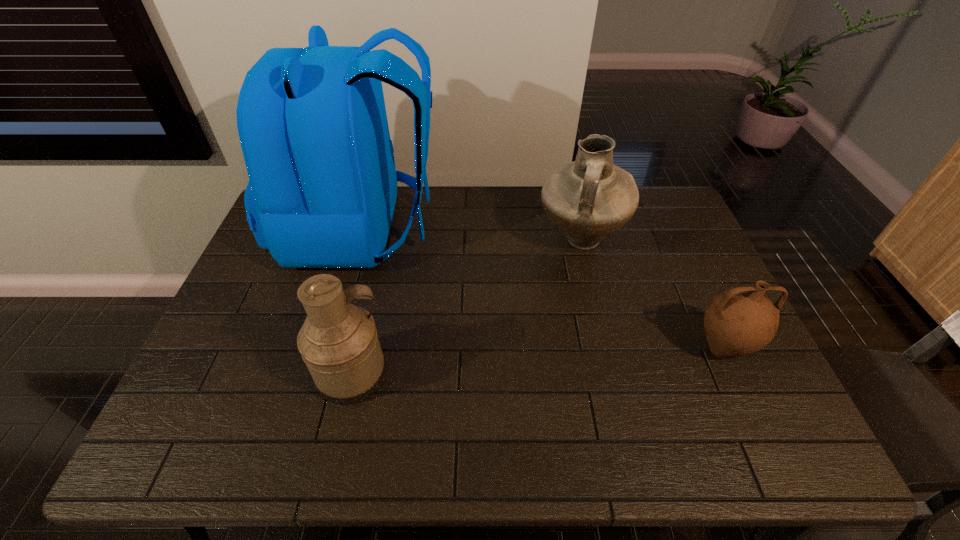
Locate an element on the screen. The height and width of the screenshot is (540, 960). backpack that is positioned at the far edge is located at coordinates (312, 123).

Identify the location of pitcher at the far edge. This screenshot has height=540, width=960. (588, 199).

You are a GUI agent. You are given a task and a screenshot of the screen. Output one action in this format:
    pyautogui.click(x=<x>, y=<y>)
    Task: Click on the object that is at the left edge
    
    Given the screenshot: What is the action you would take?
    pyautogui.click(x=312, y=123)

I want to click on object present at the right edge, so pos(739,321).

Identify the location of object located at the far left corner. This screenshot has width=960, height=540. (312, 123).

Where is `vacant space at the far edge of the desktop`? vacant space at the far edge of the desktop is located at coordinates (510, 188).

In the image, there is a desktop. Where is `vacant space at the right edge`? This screenshot has height=540, width=960. vacant space at the right edge is located at coordinates (707, 292).

You are a GUI agent. You are given a task and a screenshot of the screen. Output one action in this format:
    pyautogui.click(x=<x>, y=<y>)
    Task: Click on the vacant area at the near right corner of the desktop
    The width and height of the screenshot is (960, 540).
    Given the screenshot: What is the action you would take?
    pyautogui.click(x=784, y=443)

You are a GUI agent. You are given a task and a screenshot of the screen. Output one action in this format:
    pyautogui.click(x=<x>, y=<y>)
    Task: Click on the vacant space that's between the second pitcher from left to right and the leftmost pitcher
    The width and height of the screenshot is (960, 540).
    Given the screenshot: What is the action you would take?
    point(467,307)

The width and height of the screenshot is (960, 540). Identify the location of vacant region between the leftmost pitcher and the shortest pitcher. (538, 362).